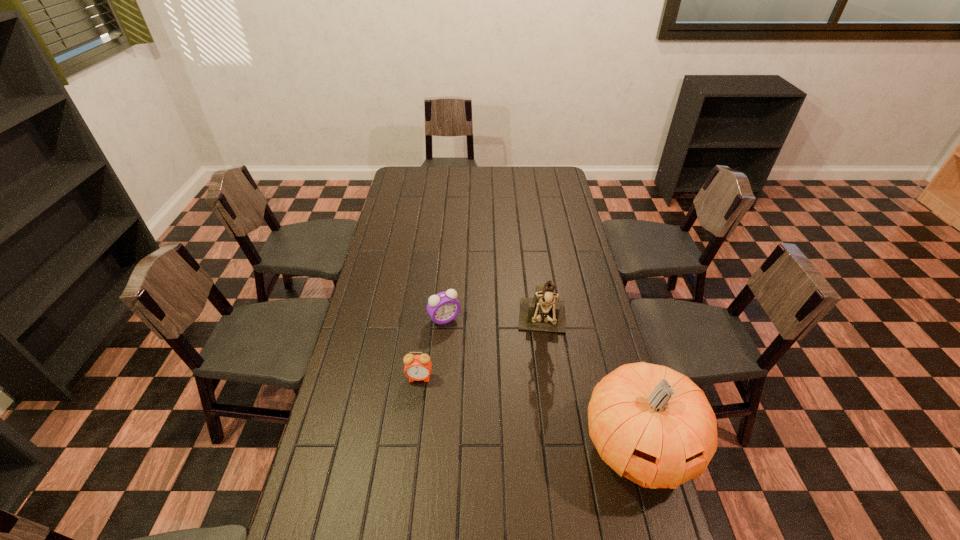
Locate an element on the screen. The image size is (960, 540). vacant region located 0.100m on the front-facing side of the figurine is located at coordinates point(544,380).

Find the location of a particular element. This screenshot has height=540, width=960. object at the near edge is located at coordinates (649, 422).

Where is `pumpkin at the right edge`? pumpkin at the right edge is located at coordinates (649, 422).

The height and width of the screenshot is (540, 960). I want to click on figurine present at the right edge, so click(543, 313).

Image resolution: width=960 pixels, height=540 pixels. Identify the location of object that is positioned at the near right corner. (649, 422).

The image size is (960, 540). Identify the location of vacant space at the far edge of the desktop. (509, 176).

In the image, there is a desktop. Where is `vacant space at the left edge`? vacant space at the left edge is located at coordinates (381, 272).

Find the location of `free space at the right edge of the desktop`. free space at the right edge of the desktop is located at coordinates (548, 258).

Locate an element on the screen. This screenshot has width=960, height=540. free spot at the far left corner of the desktop is located at coordinates click(x=426, y=169).

In the image, there is a desktop. At what (x,y) coordinates should I click in order to perform the action: click on vacant region at the far right corner. Please return your answer as a coordinate pair (x, y). The image size is (960, 540). Looking at the image, I should click on (539, 174).